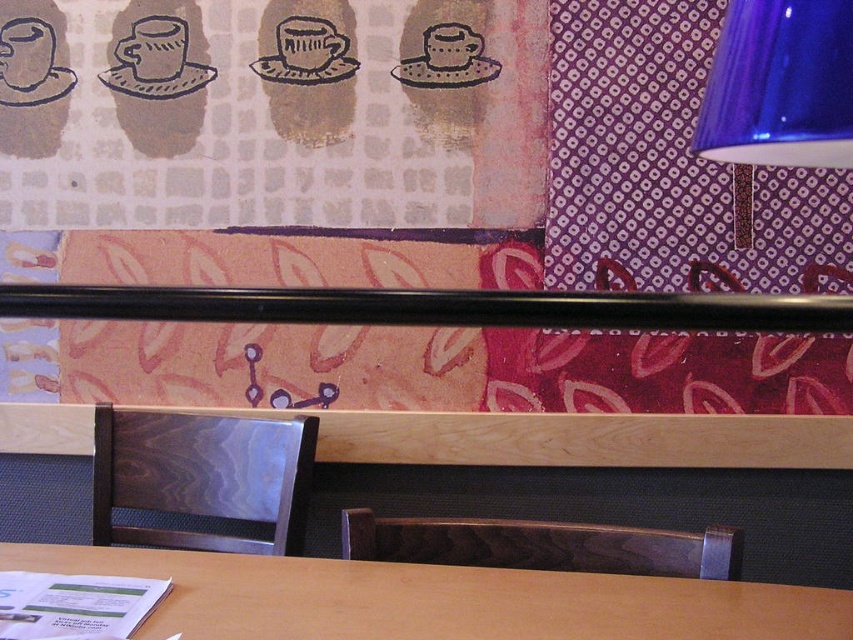
Question: Which of these objects is positioned closest to the wooden chair at lower center?

Choices:
 (A) wooden table at center
 (B) dark wood/marble chair at lower center

Answer: (A)

Question: Is blue glass lampshade at upper right behind dark wood/marble chair at lower center?

Choices:
 (A) yes
 (B) no

Answer: (B)

Question: Which object is closer to the camera taking this photo?

Choices:
 (A) blue glass lampshade at upper right
 (B) wooden chair at lower center

Answer: (A)

Question: Can you confirm if wooden chair at lower center is positioned above blue glass lampshade at upper right?

Choices:
 (A) no
 (B) yes

Answer: (A)

Question: Which point is farther from the camera taking this photo?

Choices:
 (A) (706, 602)
 (B) (100, 500)
 (C) (434, 556)
 (D) (704, 125)

Answer: (B)

Question: Does wooden chair at lower center have a larger size compared to dark wood/marble chair at lower center?

Choices:
 (A) yes
 (B) no

Answer: (A)